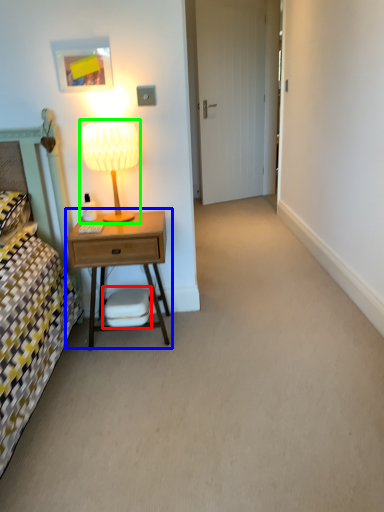
Question: Based on their relative distances, which object is nearer to swivel chair (highlighted by a red box)? Choose from nightstand (highlighted by a blue box) and table lamp (highlighted by a green box).

Choices:
 (A) nightstand
 (B) table lamp

Answer: (A)